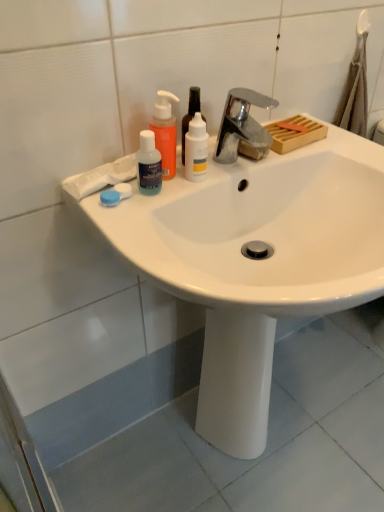
Locate an element on the screen. The height and width of the screenshot is (512, 384). vacant space to the right of white glossy bottle at center, arranged as the first mouthwash when viewed from the right is located at coordinates (256, 167).